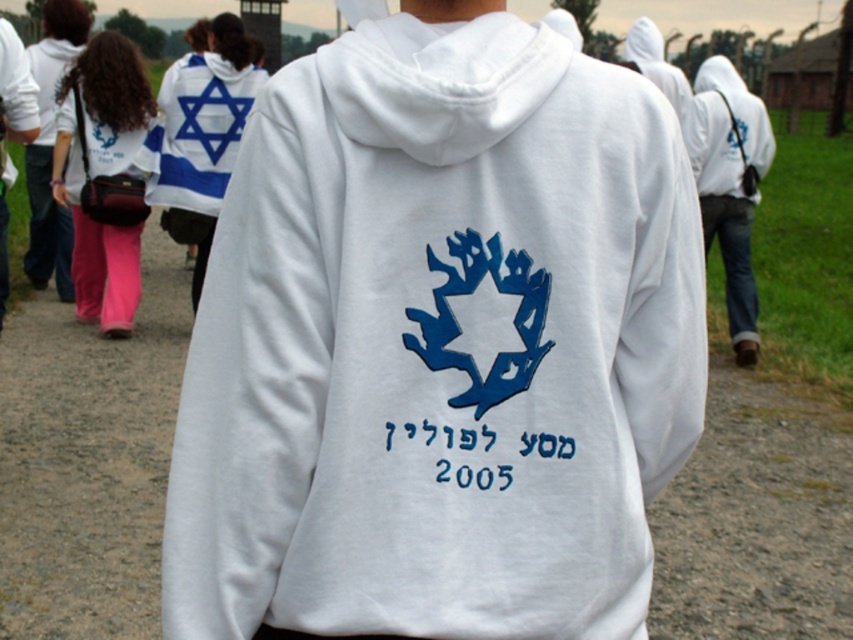
Question: Does matte white hoodie at left have a greater width compared to white fleece hoodie at upper center?

Choices:
 (A) yes
 (B) no

Answer: (A)

Question: Does matte white hoodie at left have a smaller size compared to white fleece hoodie at upper center?

Choices:
 (A) no
 (B) yes

Answer: (A)

Question: Can you confirm if matte black hoodie at left is positioned to the left of white fleece hoodie at right?

Choices:
 (A) yes
 (B) no

Answer: (A)

Question: Which is nearer to the white fleece sweatshirt at center?

Choices:
 (A) white fabric star of david at upper left
 (B) matte black hoodie at left
 (C) matte white hoodie at left
 (D) white fleece hoodie at right

Answer: (C)

Question: Which object is positioned farthest from the white fleece hoodie at upper center?

Choices:
 (A) white fabric star of david at upper left
 (B) white fleece sweatshirt at center
 (C) matte black hoodie at left
 (D) matte white hoodie at left

Answer: (B)

Question: Which of the following is the closest to the observer?

Choices:
 (A) (96, 148)
 (B) (682, 122)

Answer: (A)